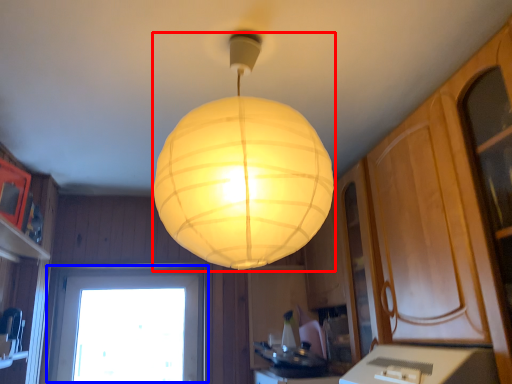
Question: Which point is further to the camera, lamp (highlighted by a red box) or window (highlighted by a blue box)?

Choices:
 (A) lamp
 (B) window

Answer: (B)